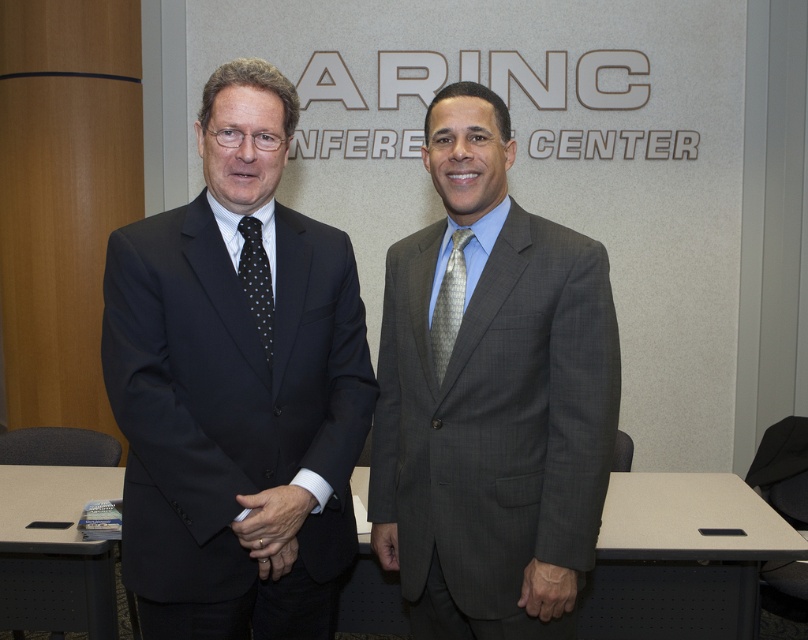
Question: Which of the following is the farthest from the observer?

Choices:
 (A) matte black suit at left
 (B) gray textured suit at center
 (C) black dotted tie at center
 (D) gray textured tie at center

Answer: (D)

Question: Where is gray textured suit at center located in relation to gray textured tie at center in the image?

Choices:
 (A) below
 (B) above

Answer: (A)

Question: Which point is closer to the camera?

Choices:
 (A) gray textured suit at center
 (B) gray textured tie at center

Answer: (A)

Question: Does gray textured suit at center appear on the right side of gray textured tie at center?

Choices:
 (A) yes
 (B) no

Answer: (A)

Question: Is gray textured tie at center wider than black dotted tie at center?

Choices:
 (A) yes
 (B) no

Answer: (A)

Question: Among these points, which one is farthest from the camera?

Choices:
 (A) (455, 257)
 (B) (470, 134)

Answer: (A)